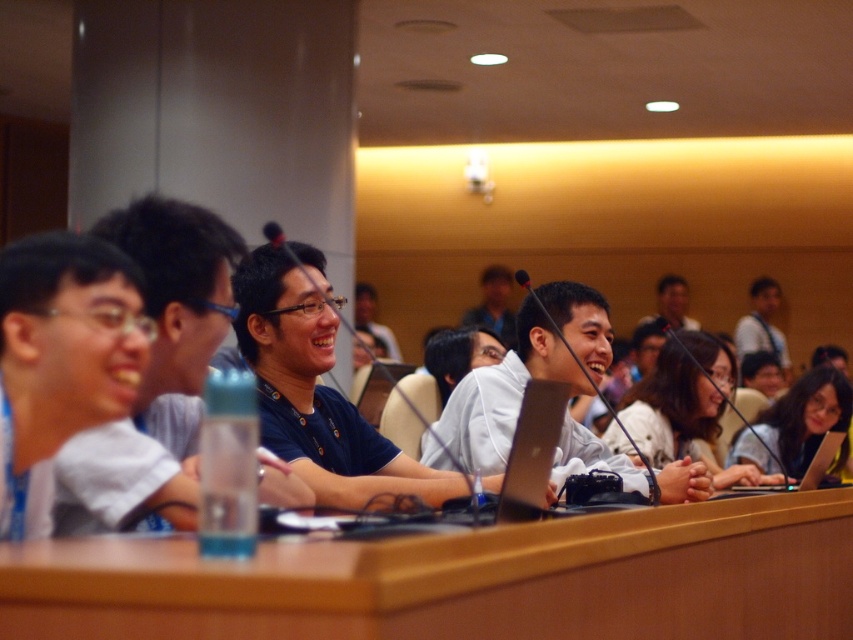
Question: Which object is closer to the camera taking this photo?

Choices:
 (A) silver metallic laptop at lower right
 (B) brown wood table at center
 (C) white matte shirt at center

Answer: (B)

Question: Considering the relative positions of white matte shirt at center and silver metallic laptop at lower right in the image provided, where is white matte shirt at center located with respect to silver metallic laptop at lower right?

Choices:
 (A) right
 (B) left

Answer: (B)

Question: Which point appears farthest from the camera in this image?

Choices:
 (A) (473, 380)
 (B) (323, 582)

Answer: (A)

Question: Is brown wood table at center to the right of silver metallic laptop at lower right from the viewer's perspective?

Choices:
 (A) no
 (B) yes

Answer: (A)

Question: Which point is closer to the camera taking this photo?

Choices:
 (A) (750, 484)
 (B) (577, 468)
 (C) (47, 577)

Answer: (C)

Question: In this image, where is brown wood table at center located relative to silver metallic laptop at lower right?

Choices:
 (A) left
 (B) right

Answer: (A)